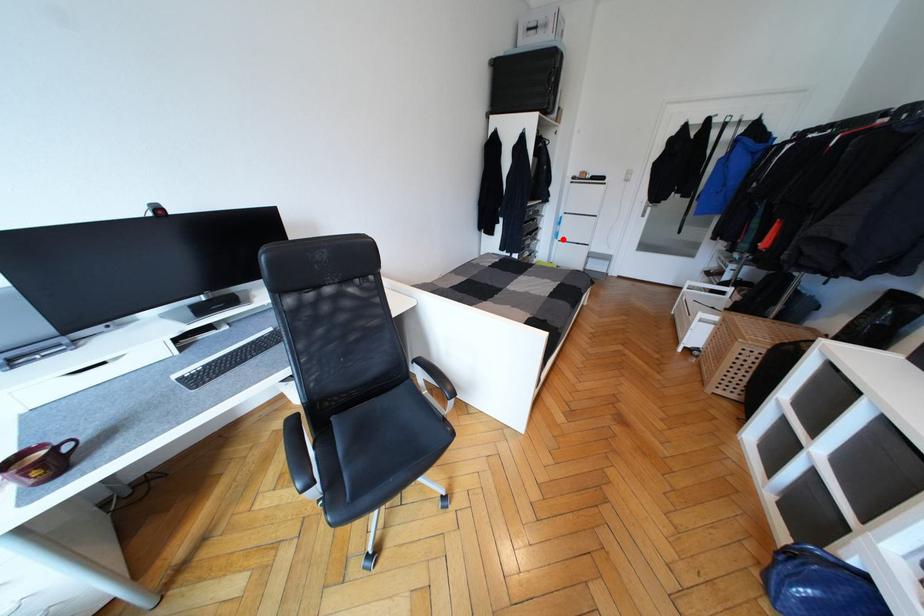
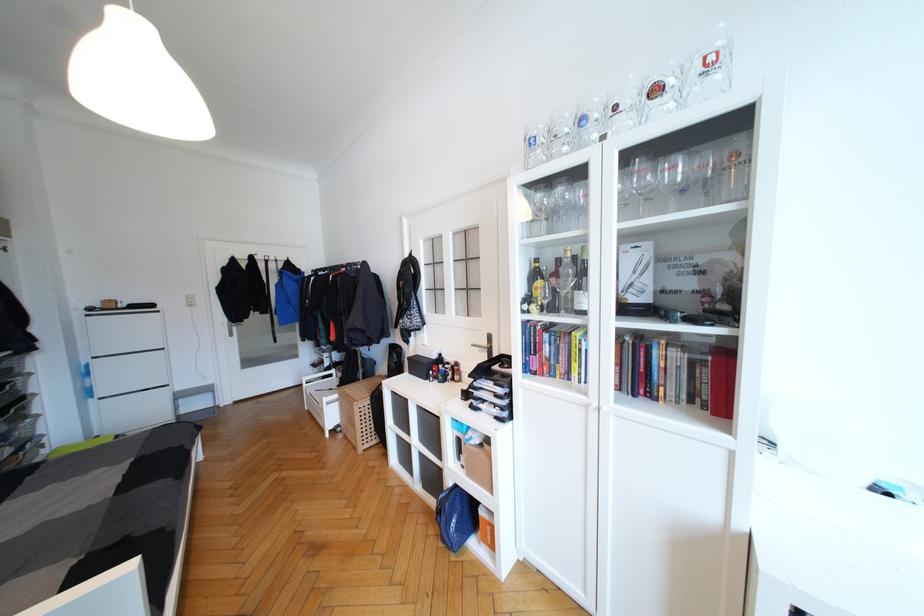
In the second image, find the point that corresponds to the highlighted location in the first image.

(103, 395)